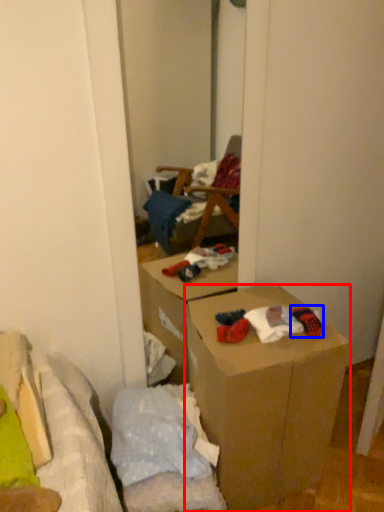
Question: Which of the following is the farthest to the observer, box (highlighted by a red box) or toy (highlighted by a blue box)?

Choices:
 (A) box
 (B) toy

Answer: (B)